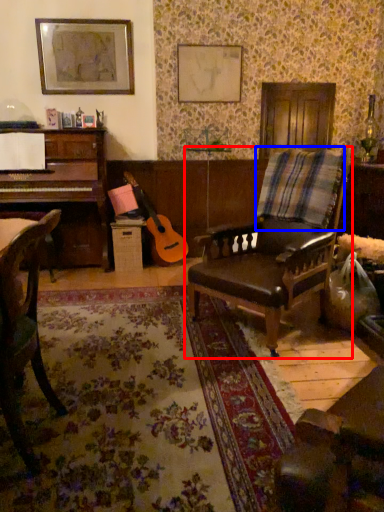
Question: Which object appears closest to the camera in this image, chair (highlighted by a red box) or plaid (highlighted by a blue box)?

Choices:
 (A) chair
 (B) plaid

Answer: (A)